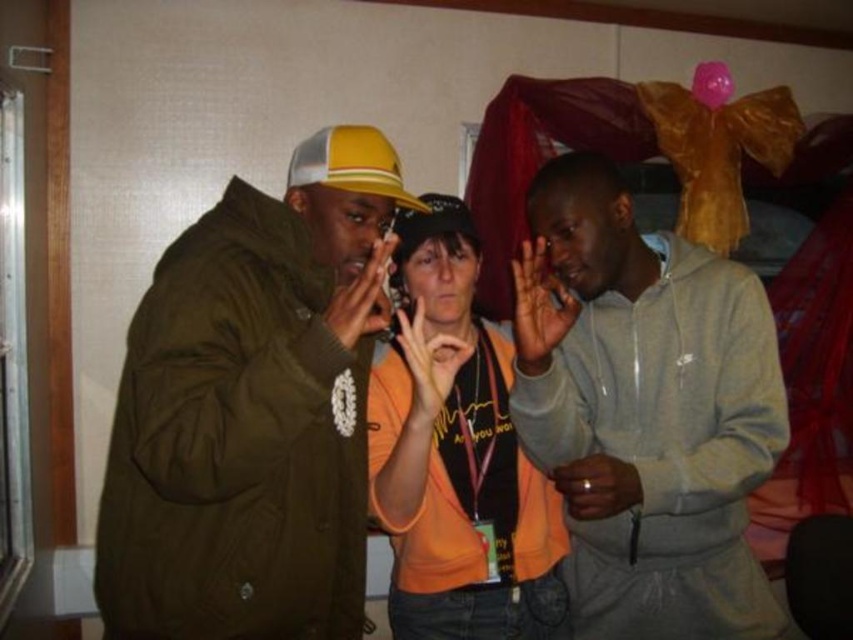
Who is positioned more to the right, yellow mesh baseball cap at upper left or matte yellow baseball cap at center?

From the viewer's perspective, matte yellow baseball cap at center appears more on the right side.

Where is `yellow mesh baseball cap at upper left`? yellow mesh baseball cap at upper left is located at coordinates (351, 163).

Between gray hoodie at center and matte yellow baseball cap at center, which one has less height?

matte yellow baseball cap at center

The height and width of the screenshot is (640, 853). What do you see at coordinates (645, 412) in the screenshot? I see `gray hoodie at center` at bounding box center [645, 412].

Between point (608, 250) and point (451, 204), which one is positioned behind?

The point (451, 204) is more distant.

Locate an element on the screen. The height and width of the screenshot is (640, 853). gray hoodie at center is located at coordinates (645, 412).

Looking at this image, between olive green jacket at left and orange fabric shirt at center, which one appears on the right side from the viewer's perspective?

orange fabric shirt at center is more to the right.

Does olive green jacket at left have a lesser width compared to orange fabric shirt at center?

Incorrect, olive green jacket at left's width is not less than orange fabric shirt at center's.

You are a GUI agent. You are given a task and a screenshot of the screen. Output one action in this format:
    pyautogui.click(x=<x>, y=<y>)
    Task: Click on the olive green jacket at left
    Image resolution: width=853 pixels, height=640 pixels.
    Given the screenshot: What is the action you would take?
    pyautogui.click(x=252, y=410)